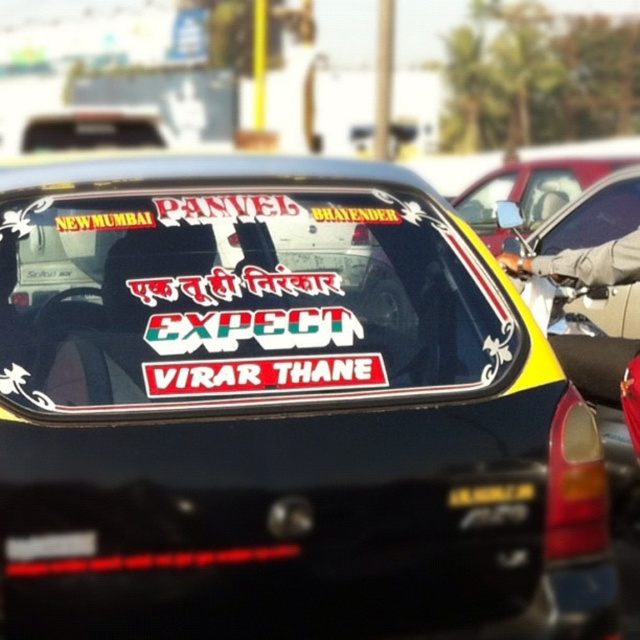
Question: Which point is farther to the camera?

Choices:
 (A) (148, 566)
 (B) (333, 368)
 (C) (516, 205)

Answer: (C)

Question: Does matte vinyl sticker at center have a greater width compared to white matte sticker at center?

Choices:
 (A) no
 (B) yes

Answer: (B)

Question: Among these points, which one is nearest to the camera?

Choices:
 (A) (337, 368)
 (B) (3, 280)
 (C) (392, 301)
 (D) (477, 200)

Answer: (A)

Question: Is matte black car at center positioned before yellow matte car at center?

Choices:
 (A) no
 (B) yes

Answer: (B)

Question: Is matte black car at center smaller than white matte sticker at center?

Choices:
 (A) no
 (B) yes

Answer: (A)

Question: Which point is farther to the camera?

Choices:
 (A) matte black car at center
 (B) yellow matte car at center
 (C) matte vinyl sticker at center
 (D) white matte sticker at center

Answer: (B)